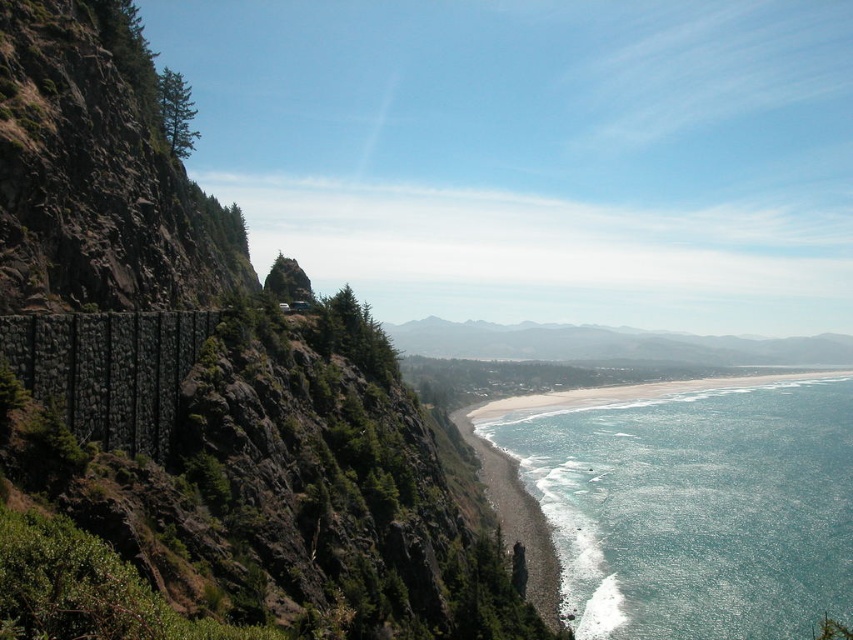
Question: Which point is closer to the camera?

Choices:
 (A) smooth sand beach at lower center
 (B) blue-green water at lower center
 (C) rocky cliff at left

Answer: (C)

Question: Does rocky cliff at left come in front of blue-green water at lower center?

Choices:
 (A) no
 (B) yes

Answer: (B)

Question: Which point is farther to the camera?

Choices:
 (A) (308, 356)
 (B) (751, 611)

Answer: (B)

Question: Is blue-green water at lower center to the left of smooth sand beach at lower center from the viewer's perspective?

Choices:
 (A) no
 (B) yes

Answer: (A)

Question: Among these objects, which one is farthest from the camera?

Choices:
 (A) smooth sand beach at lower center
 (B) rocky cliff at left

Answer: (A)

Question: Is rocky cliff at left wider than blue-green water at lower center?

Choices:
 (A) yes
 (B) no

Answer: (B)